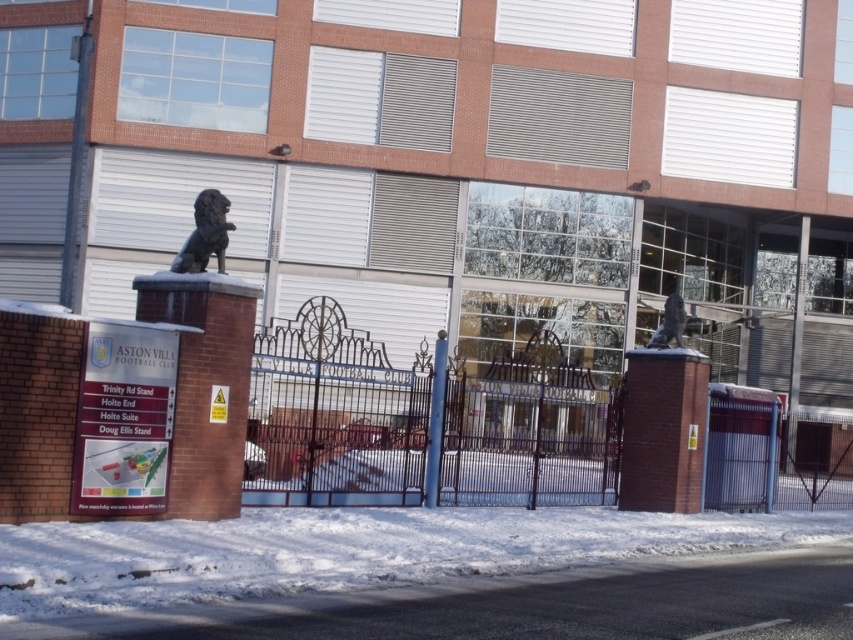
You are standing at the entrance of Aston Villa Football Club and want to locate the black polished stone lion at upper center. According to the coordinates given, where exactly is it positioned?

The black polished stone lion at upper center is positioned at coordinates point (206, 234).

You are a delivery person trying to see the Aston Villa Football Club emblem on the gate. The emblem is located on the black wrought iron fence at center. Considering the height of the black polished stone lion at upper center, do you think you can see the emblem without climbing over anything?

The black wrought iron fence at center is not as tall as the black polished stone lion at upper center, so the emblem on the fence should be visible below the lion statue. Since the lion is taller, it might block part of the view, but the emblem is likely still visible without needing to climb.